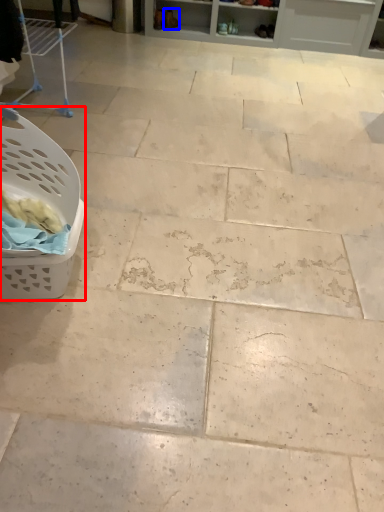
Question: Which object appears farthest to the camera in this image, basket (highlighted by a red box) or footwear (highlighted by a blue box)?

Choices:
 (A) basket
 (B) footwear

Answer: (B)